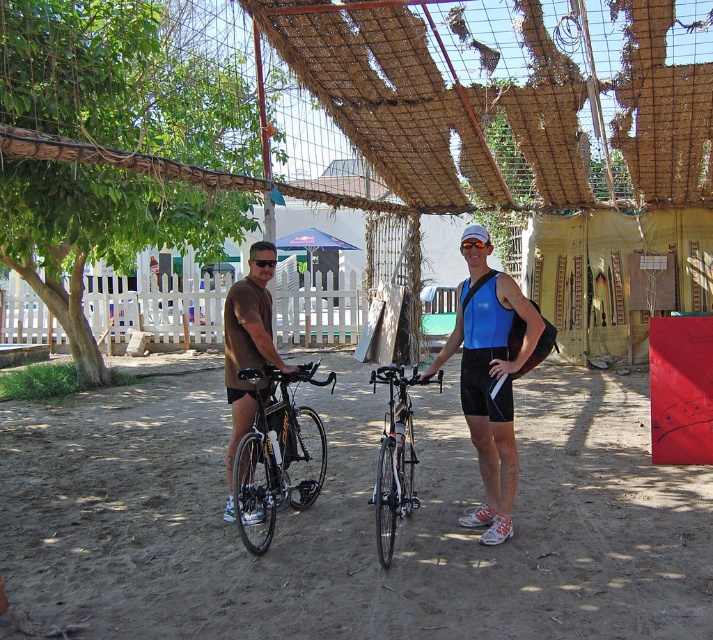
Question: Which point appears closest to the camera in this image?

Choices:
 (A) (394, 429)
 (B) (533, 577)
 (C) (307, 486)
 (D) (496, 500)

Answer: (B)

Question: Observing the image, what is the correct spatial positioning of blue matte tank top at center in reference to black matte bicycle at center?

Choices:
 (A) above
 (B) below

Answer: (A)

Question: In this image, where is brown sandy dirt track at center located relative to matte black bicycle at center?

Choices:
 (A) right
 (B) left

Answer: (B)

Question: Does black matte bicycle at center have a greater width compared to brown matte shorts at center?

Choices:
 (A) yes
 (B) no

Answer: (B)

Question: Among these objects, which one is farthest from the camera?

Choices:
 (A) blue matte tank top at center
 (B) silver metallic bicycle at center
 (C) black matte bicycle at center
 (D) brown sandy dirt track at center

Answer: (A)

Question: Among these points, which one is farthest from the camera?

Choices:
 (A) (486, 493)
 (B) (513, 452)

Answer: (A)